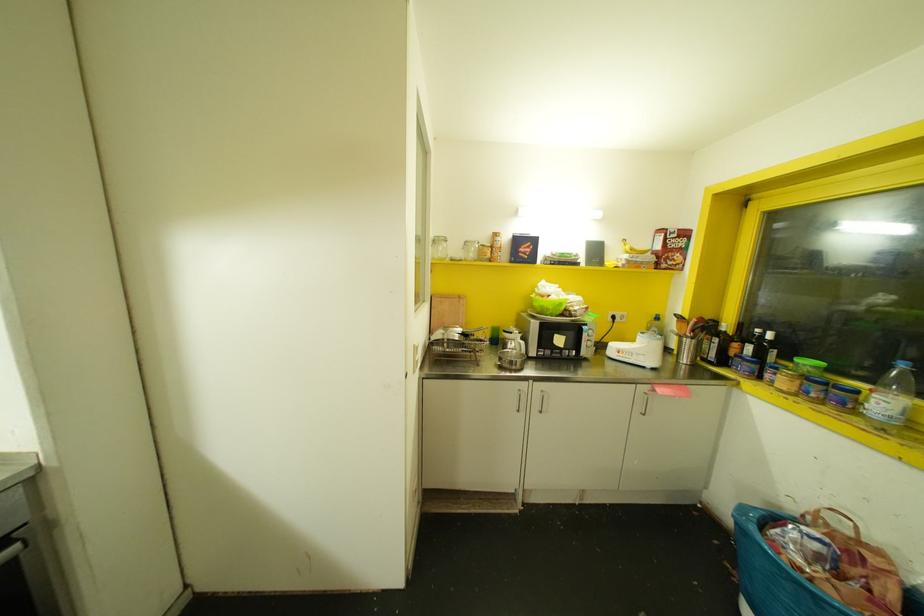
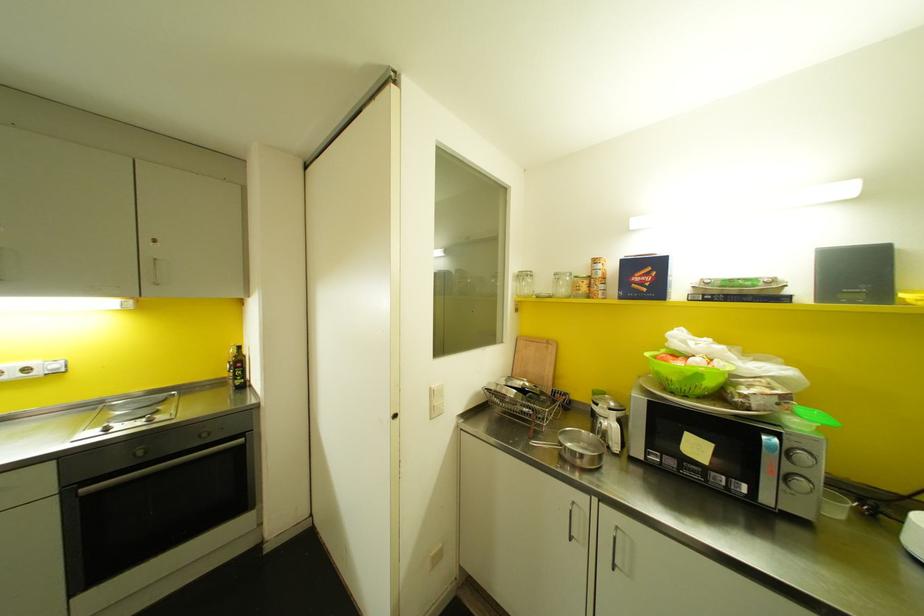
In the second image, find the point that corresponds to pixel 412 345 in the first image.

(430, 387)